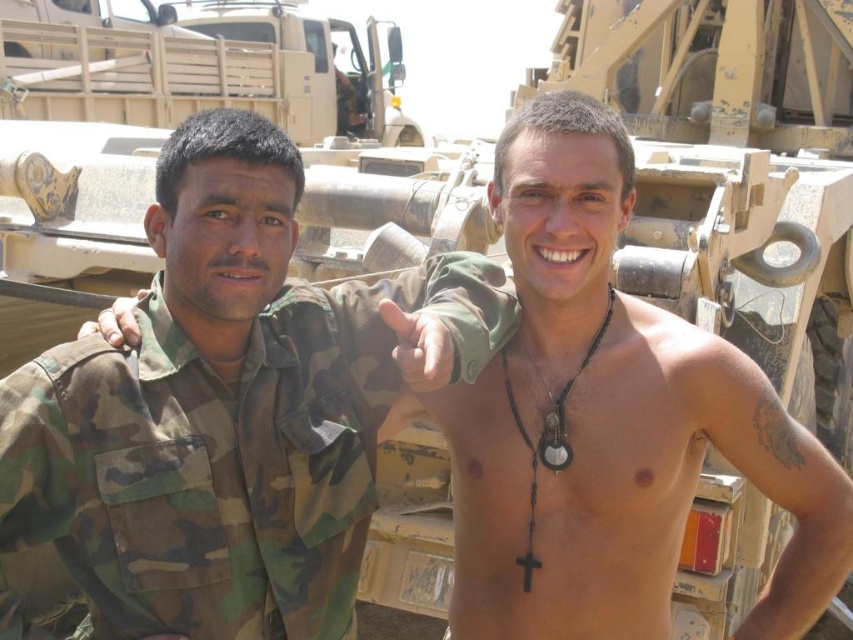
You are a photographer trying to capture both hands in the frame. Given that the matte skin hand at center is smaller in width than the camouflage fabric hand at center, which hand should you adjust to ensure both fit comfortably in the photo?

Since the matte skin hand at center is smaller in width than the camouflage fabric hand at center, you should adjust the positioning of the camouflage fabric hand at center to accommodate its larger size and ensure both hands fit comfortably in the photo.

You are a photographer trying to capture a clear shot of both the camouflage fabric shirt at left and the camouflage fabric hand at center. Given their height difference, which object should you focus on first to ensure it is in frame and properly exposed?

The camouflage fabric shirt at left is much taller than the camouflage fabric hand at center, so you should focus on the camouflage fabric shirt at left first to ensure it is properly exposed and in frame before adjusting for the smaller hand.